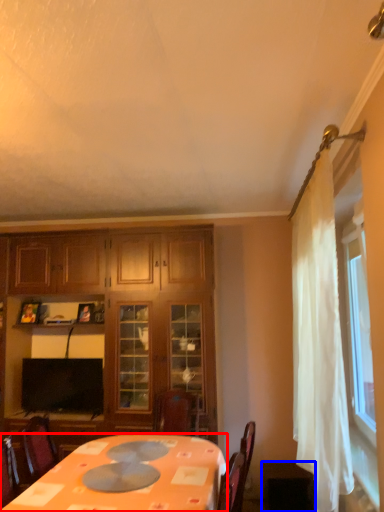
Question: Which of the following is the farthest to the observer, desk (highlighted by a red box) or table (highlighted by a blue box)?

Choices:
 (A) desk
 (B) table

Answer: (B)